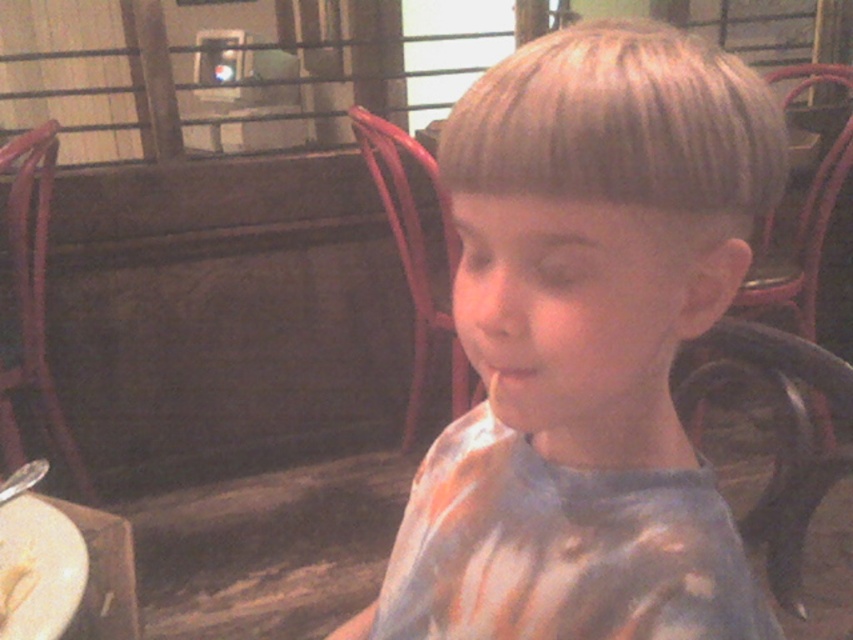
You are a waiter at the restaurant. You need to place a small napkin between the white matte plate at lower left and the white creamy food at lower left. Is there enough space to fit the napkin?

The white matte plate at lower left is 1.13 inches away from the white creamy food at lower left. Since the napkin is small, it can fit in the space between them.